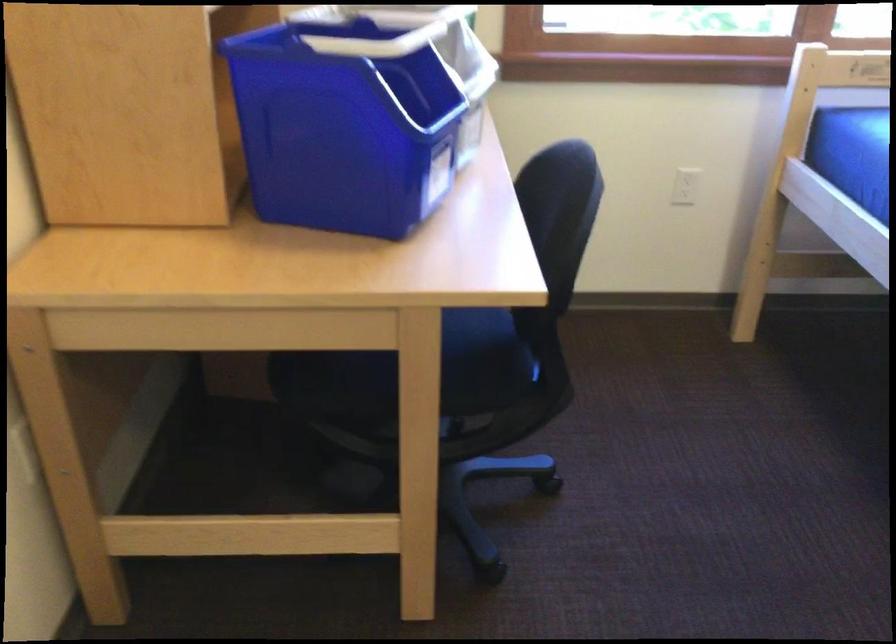
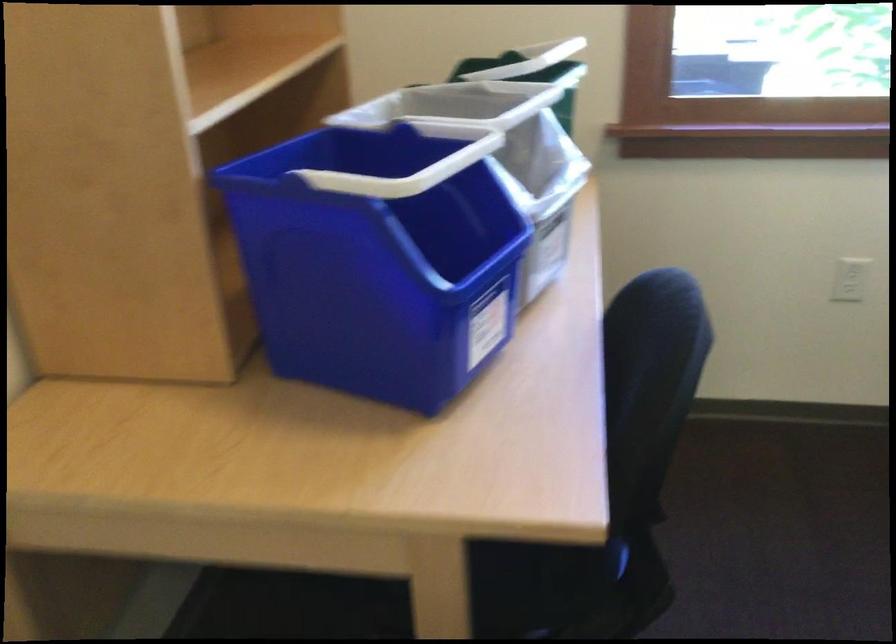
Which direction would the cameraman need to move to produce the second image?

The movement direction of the cameraman is right, forward.